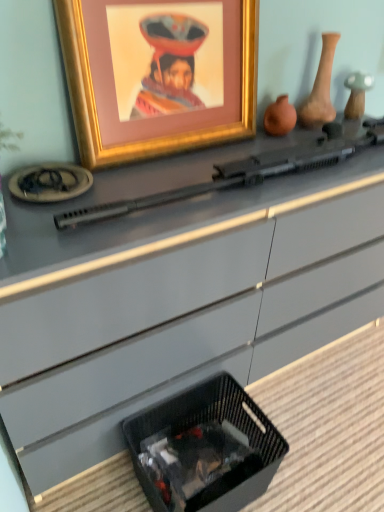
I want to click on free location to the right of matte clay vase at upper center, which is the second vase in right-to-left order, so click(336, 137).